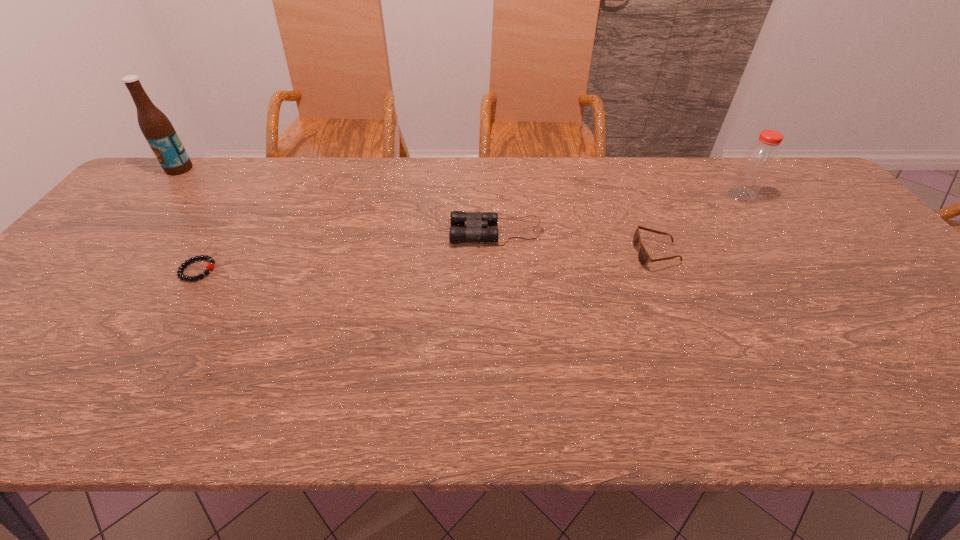
Where is `the leftmost object`? the leftmost object is located at coordinates (157, 129).

Where is `the farthest object`? This screenshot has height=540, width=960. the farthest object is located at coordinates (157, 129).

Where is `the second farthest object`? the second farthest object is located at coordinates (759, 161).

Identify the location of bottle. (759, 161).

You are a GUI agent. You are given a task and a screenshot of the screen. Output one action in this format:
    pyautogui.click(x=<x>, y=<y>)
    Task: Click on the binoculars
    
    Given the screenshot: What is the action you would take?
    pyautogui.click(x=473, y=221)

The image size is (960, 540). Find the location of `sunglasses`. sunglasses is located at coordinates (643, 256).

The height and width of the screenshot is (540, 960). What are the coordinates of `the second object from left to right` in the screenshot? It's located at (210, 266).

Where is `bracelet`? Image resolution: width=960 pixels, height=540 pixels. bracelet is located at coordinates (210, 266).

Identify the location of vacant space situated on the right of the farthest object. (315, 168).

I want to click on blank area located 0.400m on the front of the rightmost object, so click(x=820, y=307).